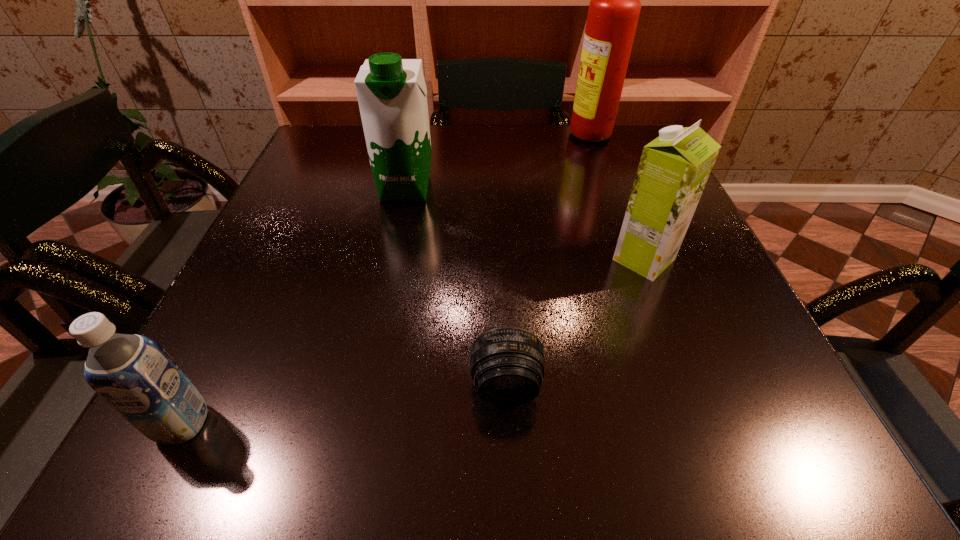
Identify the location of vacant space located on the front-facing side of the tallest object. point(513,138).

Image resolution: width=960 pixels, height=540 pixels. What are the coordinates of `vacant space situated 0.050m on the front-facing side of the tallest object` in the screenshot? It's located at (551, 138).

Where is `free space located on the front-facing side of the tallest object`? The image size is (960, 540). free space located on the front-facing side of the tallest object is located at coordinates (452, 138).

Locate an element on the screen. vacant space situated 0.220m on the front-facing side of the fourth nearest object is located at coordinates (387, 278).

The width and height of the screenshot is (960, 540). I want to click on vacant area located 0.080m on the front of the rightmost soya milk, so click(x=666, y=316).

Locate an element on the screen. The height and width of the screenshot is (540, 960). blank space located at the front element of the shortest object is located at coordinates (509, 454).

Find the location of `object that is at the far edge`. object that is at the far edge is located at coordinates (614, 9).

What are the coordinates of `soya milk that is positioned at the near edge` in the screenshot? It's located at (132, 373).

Find the location of a particular element. The height and width of the screenshot is (540, 960). telephoto lens present at the near edge is located at coordinates (507, 364).

At what (x,y) coordinates should I click in order to perform the action: click on object that is at the left edge. Please return your answer as a coordinate pair (x, y). Image resolution: width=960 pixels, height=540 pixels. Looking at the image, I should click on (132, 373).